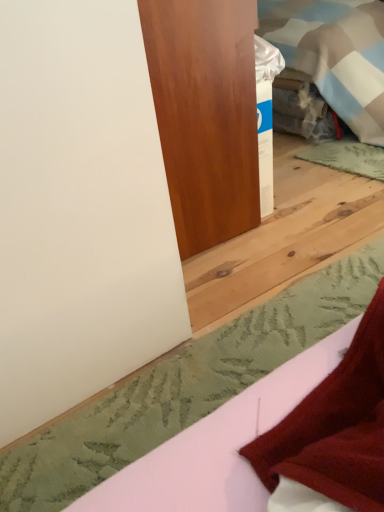
This screenshot has width=384, height=512. What are the coordinates of `free point in front of satin wood door at upper center` in the screenshot? It's located at (260, 283).